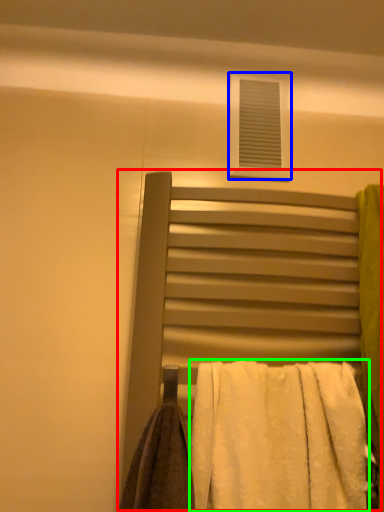
Question: Considering the real-world distances, which object is closest to bed (highlighted by a red box)? window (highlighted by a blue box) or towel (highlighted by a green box).

Choices:
 (A) window
 (B) towel

Answer: (B)